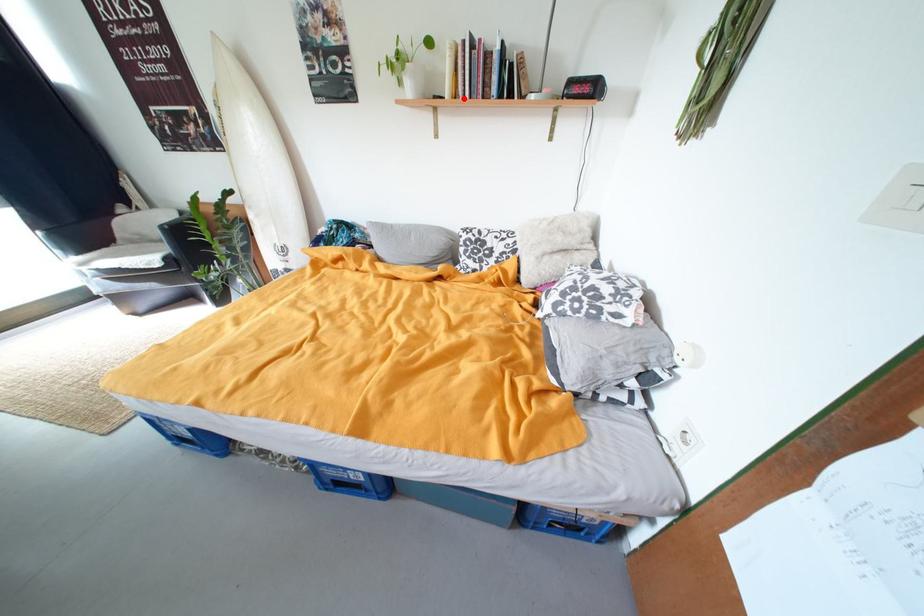
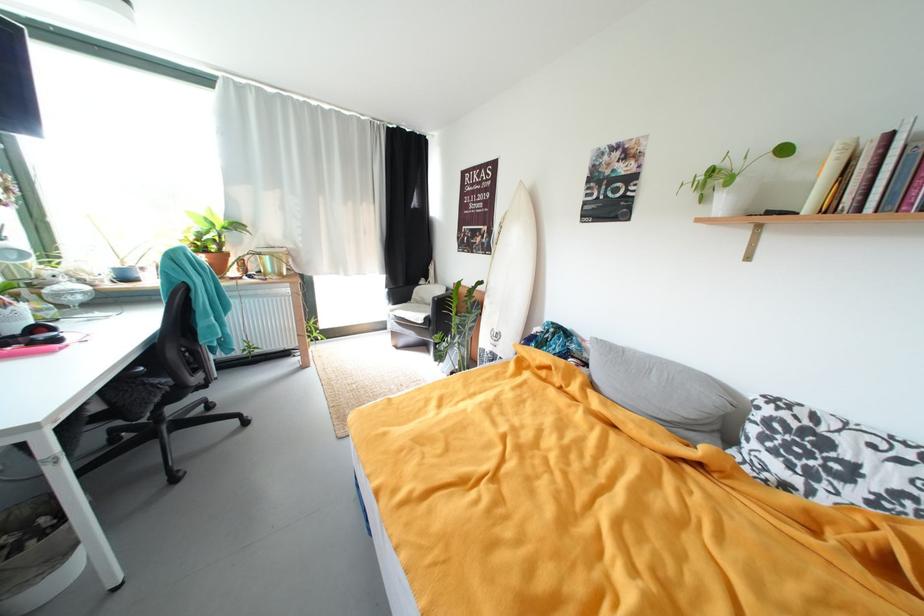
Locate, in the second image, the point that corresponds to the highlighted location in the first image.

(837, 212)